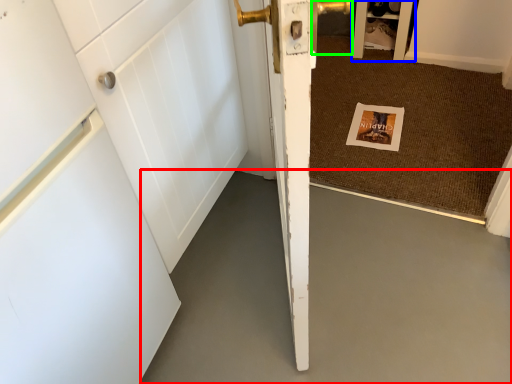
Question: Which object is the farthest from concrete (highlighted by a red box)? Choose among these: cabinetry (highlighted by a blue box) or door handle (highlighted by a green box).

Choices:
 (A) cabinetry
 (B) door handle

Answer: (B)